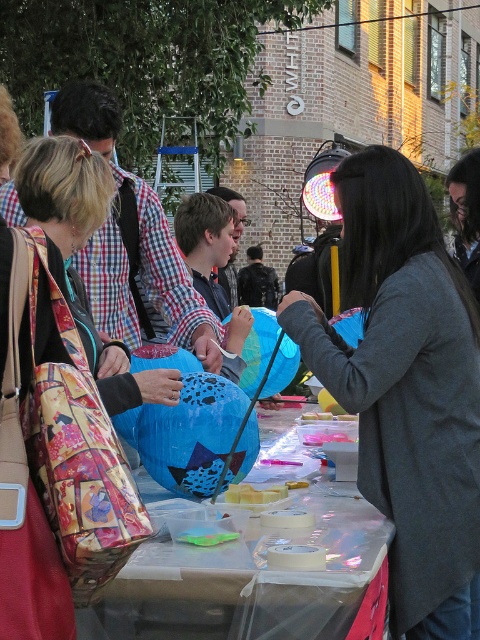
You are organizing a party and need to place a printed fabric bag at left on top of the translucent plastic table at center. Will the bag fit entirely on the table without hanging over the edges?

The translucent plastic table at center is wider than the printed fabric bag at left, so the bag will fit entirely on the table without any overhang.

You are organizing a party and need to choose between the printed fabric bag at left and the floral fabric bag at left. Based on their sizes, which one can hold more items?

The floral fabric bag at left can hold more items because it occupies more space than the printed fabric bag at left.